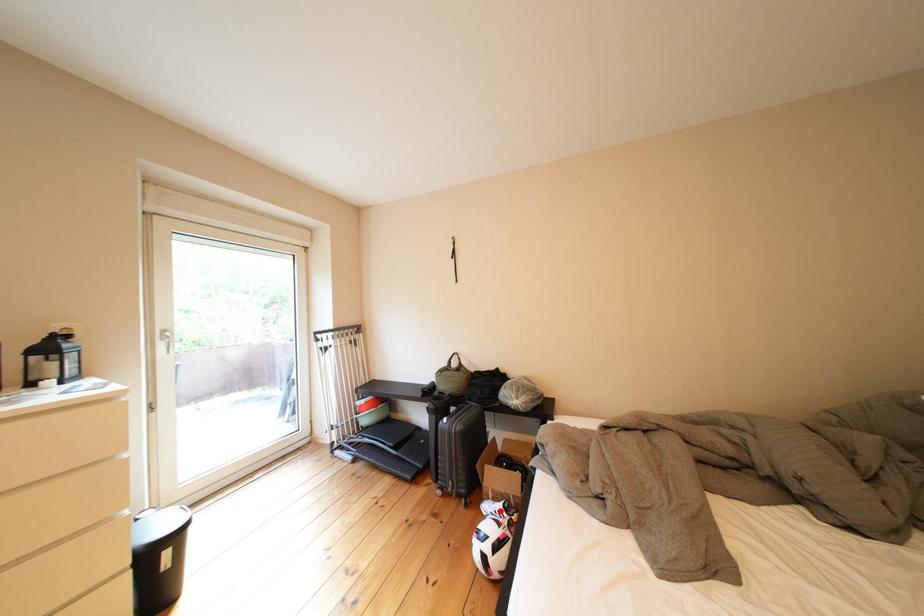
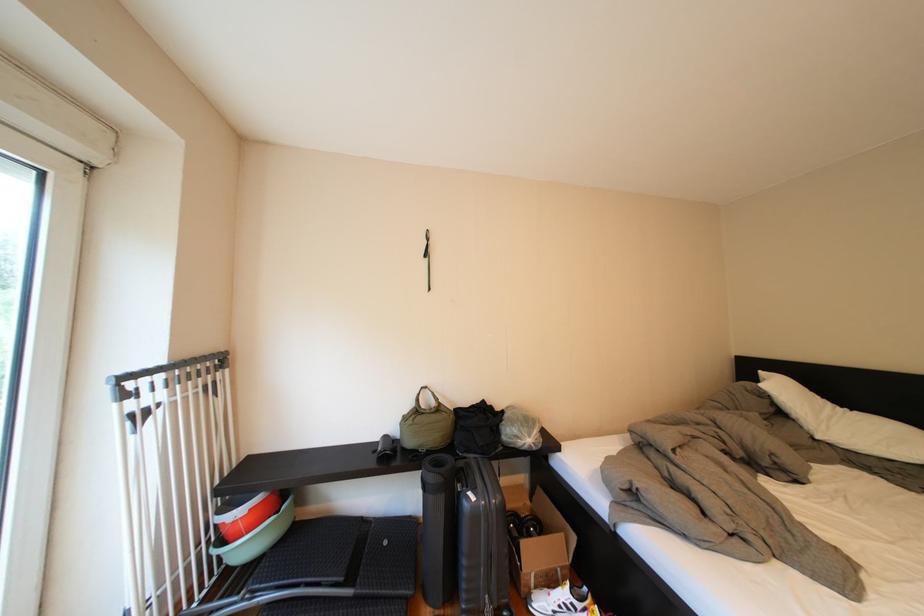
Question: I am providing you with two images of the same scene from different viewpoints. In image1, a red point is highlighted. Considering the same 3D point in image2, which of the following is correct?

Choices:
 (A) It is closer
 (B) It is farther

Answer: (A)